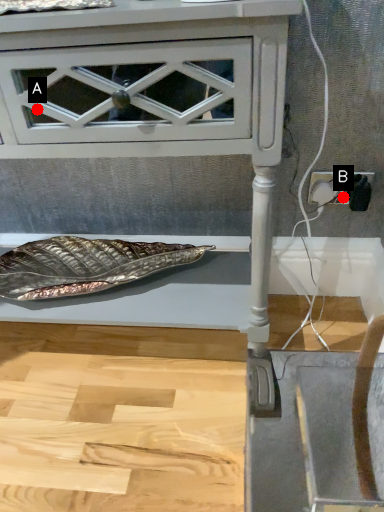
Question: Two points are circled on the image, labeled by A and B beside each circle. Which point is farther to the camera?

Choices:
 (A) A is further
 (B) B is further

Answer: (B)